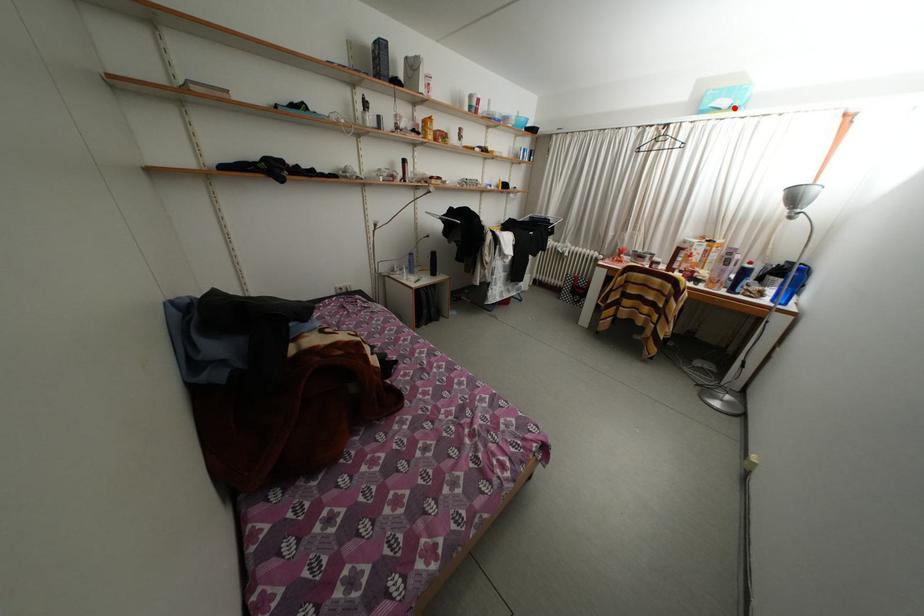
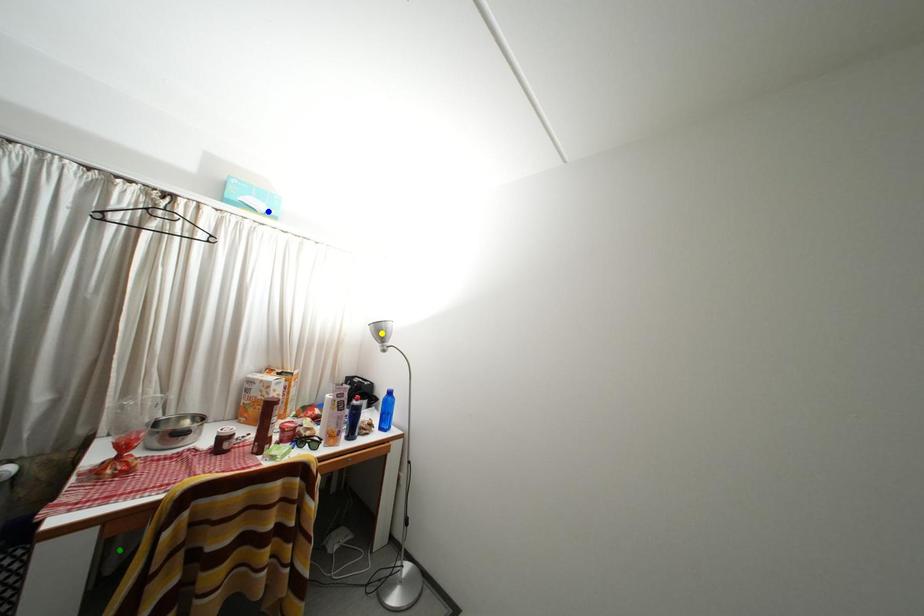
Question: I am providing you with two images of the same scene from different viewpoints. A red point is marked on the first image. You are given multiple points on the second image. In image 2, which mark is for the same physical point as the one in image 1?

Choices:
 (A) blue point
 (B) green point
 (C) yellow point

Answer: (A)